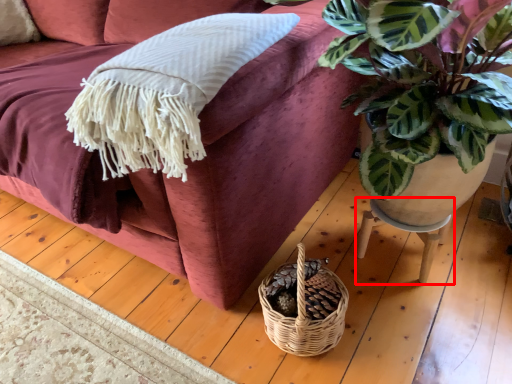
Question: From the image's perspective, where is table (annotated by the red box) located relative to studio couch?

Choices:
 (A) below
 (B) above

Answer: (A)